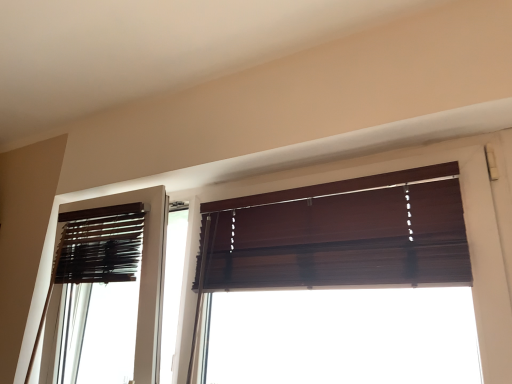
Question: Is brown matte blinds at left in front of or behind dark wood blinds at upper center in the image?

Choices:
 (A) front
 (B) behind

Answer: (B)

Question: Is brown matte blinds at left taller or shorter than dark wood blinds at upper center?

Choices:
 (A) short
 (B) tall

Answer: (A)

Question: Visually, is brown matte blinds at left positioned to the left or to the right of dark wood blinds at upper center?

Choices:
 (A) left
 (B) right

Answer: (A)

Question: From a real-world perspective, is dark wood blinds at upper center positioned above or below brown matte blinds at left?

Choices:
 (A) above
 (B) below

Answer: (A)

Question: Is dark wood blinds at upper center wider or thinner than brown matte blinds at left?

Choices:
 (A) thin
 (B) wide

Answer: (A)

Question: Considering the positions of point [346, 200] and point [53, 360], is point [346, 200] closer or farther from the camera than point [53, 360]?

Choices:
 (A) closer
 (B) farther

Answer: (A)

Question: Choose the correct answer: Is dark wood blinds at upper center inside brown matte blinds at left or outside it?

Choices:
 (A) inside
 (B) outside

Answer: (B)